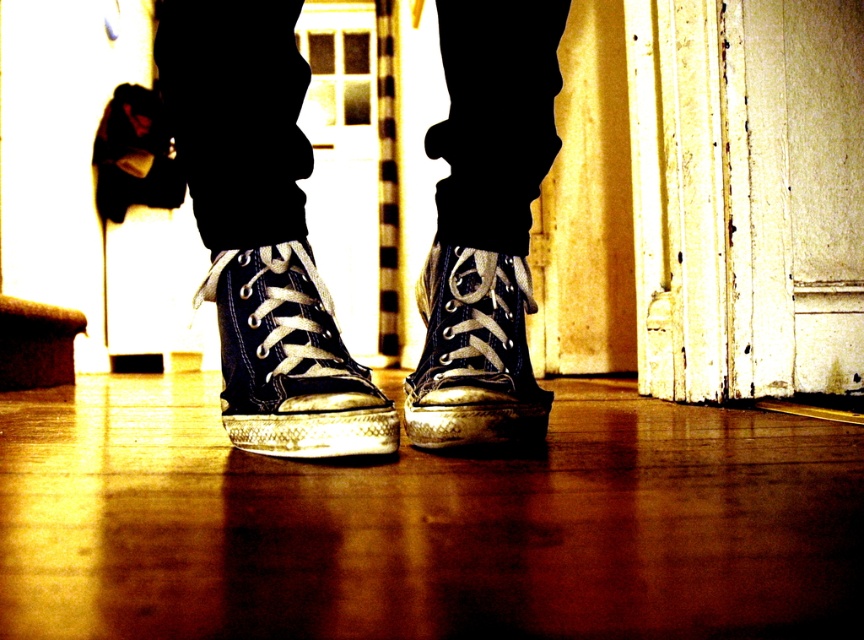
You are trying to determine if the checkerboard fabric door at center can be opened without touching the matte black sneaker at center. Based on their heights, is this possible?

The checkerboard fabric door at center has a greater height compared to the matte black sneaker at center, so it can be opened without touching the sneaker as long as the door is opened upwards or sideways within its height range.

You are a photographer trying to capture a detailed shot of the high top sneakers. The camera is positioned at a certain distance. If you want to ensure the entire shoe fits in the frame without cropping, what is the minimum distance you should maintain from the point marked at coordinate point (450, 124)?

The minimum distance you should maintain is 3.31 feet from the point marked at coordinate point (450, 124) to ensure the entire shoe fits in the frame without cropping.